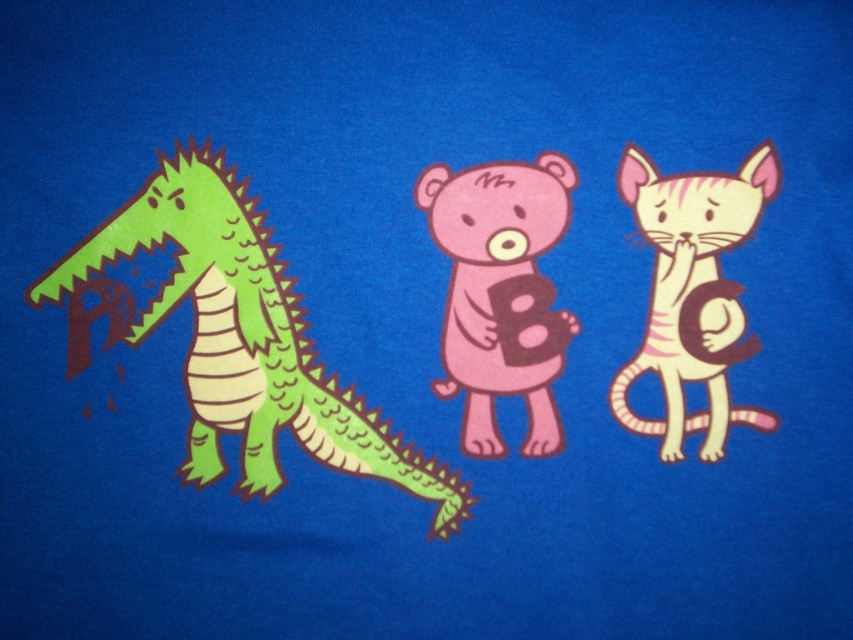
This screenshot has height=640, width=853. I want to click on green matte/dull dragon at left, so pyautogui.click(x=233, y=337).

Can you confirm if green matte/dull dragon at left is positioned to the right of white striped fur cat at right?

Incorrect, green matte/dull dragon at left is not on the right side of white striped fur cat at right.

Which is in front, point (321, 371) or point (697, 344)?

Point (697, 344)

You are a GUI agent. You are given a task and a screenshot of the screen. Output one action in this format:
    pyautogui.click(x=<x>, y=<y>)
    Task: Click on the green matte/dull dragon at left
    
    Given the screenshot: What is the action you would take?
    pyautogui.click(x=233, y=337)

Can you confirm if pink matte bear at center is shorter than white striped fur cat at right?

Yes, pink matte bear at center is shorter than white striped fur cat at right.

Is point (548, 397) in front of point (693, 365)?

No.

I want to click on pink matte bear at center, so click(502, 292).

Who is positioned more to the left, green matte/dull dragon at left or pink matte bear at center?

From the viewer's perspective, green matte/dull dragon at left appears more on the left side.

Which is in front, point (222, 176) or point (492, 200)?

Point (222, 176) is in front.

Where is `green matte/dull dragon at left`? This screenshot has height=640, width=853. green matte/dull dragon at left is located at coordinates (233, 337).